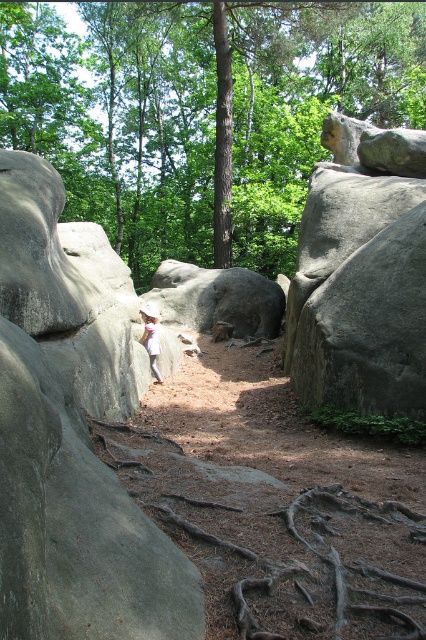
Who is higher up, brown/rooted tree roots at center or gray rough rock at upper right?

gray rough rock at upper right is above.

How much distance is there between brown/rooted tree roots at center and gray rough rock at upper right?

brown/rooted tree roots at center and gray rough rock at upper right are 3.64 meters apart.

Image resolution: width=426 pixels, height=640 pixels. I want to click on brown/rooted tree roots at center, so click(278, 545).

Between point (374, 214) and point (150, 349), which one is positioned behind?

The point (150, 349) is behind.

Is gray rough rock at upper right bigger than white cotton shirt at center?

Incorrect, gray rough rock at upper right is not larger than white cotton shirt at center.

Locate an element on the screen. The image size is (426, 640). gray rough rock at upper right is located at coordinates (362, 273).

Describe the element at coordinates (278, 545) in the screenshot. I see `brown/rooted tree roots at center` at that location.

Locate an element on the screen. The width and height of the screenshot is (426, 640). brown/rooted tree roots at center is located at coordinates (278, 545).

Where is `brown/rooted tree roots at center`? The image size is (426, 640). brown/rooted tree roots at center is located at coordinates (278, 545).